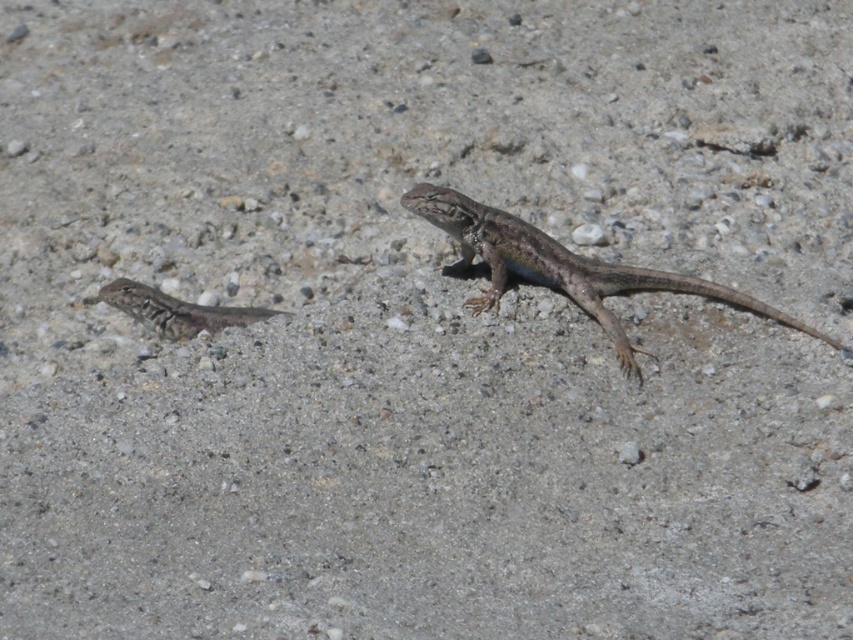
Question: From the image, what is the correct spatial relationship of speckled brown lizard at center in relation to camouflage-patterned lizard at left?

Choices:
 (A) below
 (B) above

Answer: (B)

Question: Which object is closer to the camera taking this photo?

Choices:
 (A) speckled brown lizard at center
 (B) camouflage-patterned lizard at left

Answer: (A)

Question: Can you confirm if speckled brown lizard at center is positioned to the right of camouflage-patterned lizard at left?

Choices:
 (A) no
 (B) yes

Answer: (B)

Question: Is speckled brown lizard at center below camouflage-patterned lizard at left?

Choices:
 (A) yes
 (B) no

Answer: (B)

Question: Which object appears farthest from the camera in this image?

Choices:
 (A) camouflage-patterned lizard at left
 (B) speckled brown lizard at center

Answer: (A)